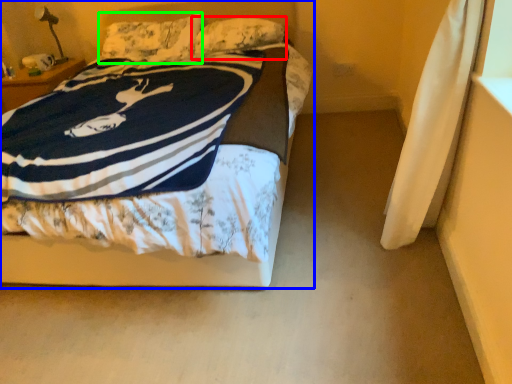
Question: Estimate the real-world distances between objects in this image. Which object is farther from pillow (highlighted by a red box), bed (highlighted by a blue box) or pillow (highlighted by a green box)?

Choices:
 (A) bed
 (B) pillow

Answer: (A)